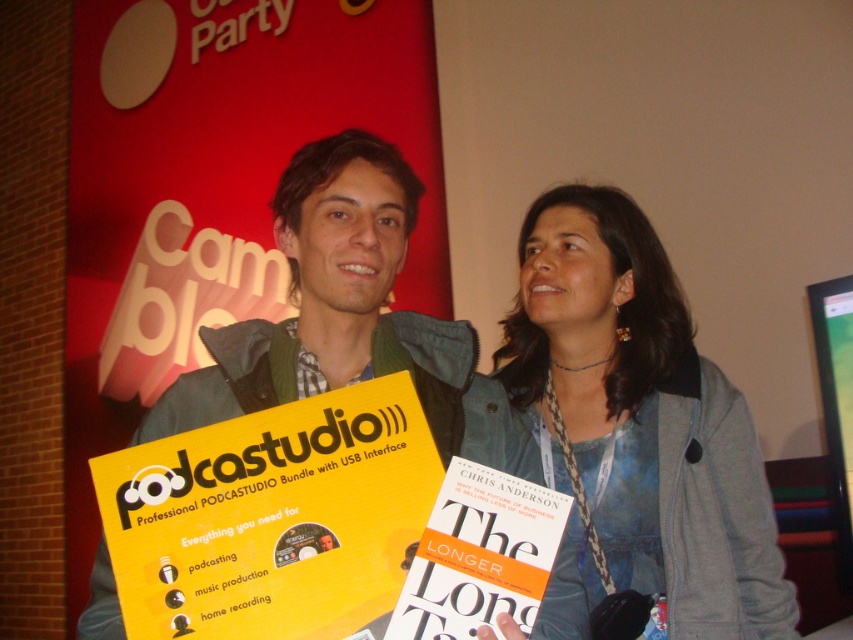
Who is shorter, denim jacket at center or yellow paperboard at center?

Standing shorter between the two is yellow paperboard at center.

Based on the photo, who is taller, denim jacket at center or yellow paperboard at center?

Standing taller between the two is denim jacket at center.

Is point (776, 570) positioned behind point (386, 228)?

Yes, point (776, 570) is farther from viewer.

I want to click on denim jacket at center, so click(x=642, y=419).